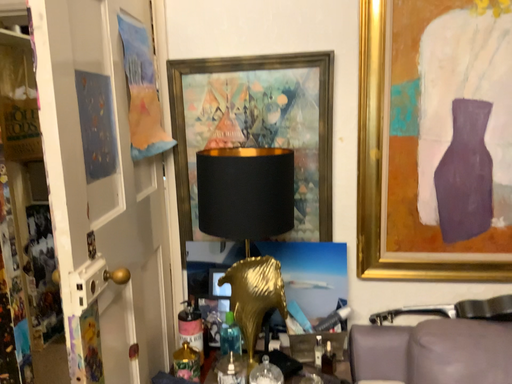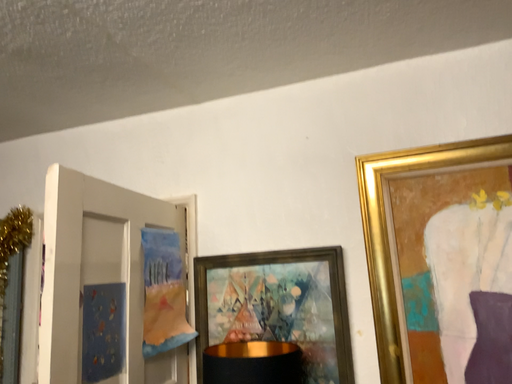
Question: Which way did the camera rotate in the video?

Choices:
 (A) rotated left
 (B) rotated right

Answer: (A)